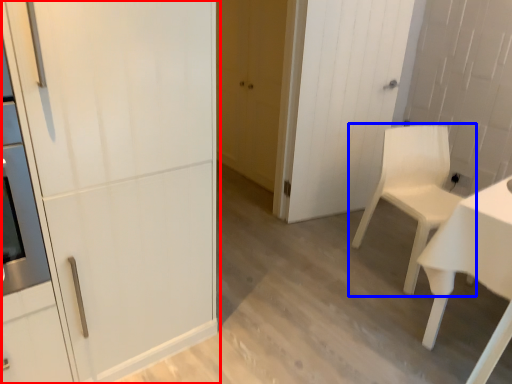
Question: Which point is closer to the camera, door (highlighted by a red box) or chair (highlighted by a blue box)?

Choices:
 (A) door
 (B) chair

Answer: (A)